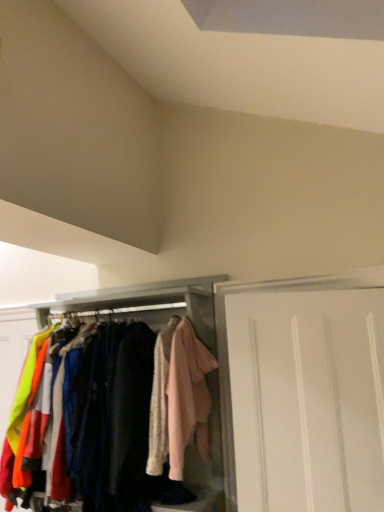
You are a GUI agent. You are given a task and a screenshot of the screen. Output one action in this format:
    pyautogui.click(x=<x>, y=<y>)
    Task: Click on the light pink fabric at center
    
    Given the screenshot: What is the action you would take?
    pyautogui.click(x=178, y=398)

Measure the distance between light pink fabric at center and camera.

light pink fabric at center and camera are 6.21 feet apart.

Find the location of a particular element. The width and height of the screenshot is (384, 512). white matte cabinet at center is located at coordinates (105, 316).

From a real-world perspective, is light pink fabric at center on top of white matte cabinet at center?

Yes, from a real-world perspective, light pink fabric at center is over white matte cabinet at center

Is light pink fabric at center at the right side of white matte cabinet at center?

Yes, light pink fabric at center is to the right of white matte cabinet at center.

Is light pink fabric at center looking in the opposite direction of white matte cabinet at center?

Absolutely, light pink fabric at center is directed away from white matte cabinet at center.

In terms of size, does white matte door at right appear bigger or smaller than white matte cabinet at center?

Clearly, white matte door at right is smaller in size than white matte cabinet at center.

Does point (224, 314) come farther from viewer compared to point (110, 291)?

No, it is in front of (110, 291).

Is white matte door at right not inside white matte cabinet at center?

That's correct, white matte door at right is outside of white matte cabinet at center.

Is white matte cabinet at center spatially inside light pink fabric at center, or outside of it?

white matte cabinet at center is located beyond the bounds of light pink fabric at center.

Identify the location of cabinetry on the left of light pink fabric at center. This screenshot has width=384, height=512. (105, 316).

Can you tell me how much white matte cabinet at center and light pink fabric at center differ in facing direction?

They differ by 4.7 degrees in their facing directions.

Considering the sizes of objects white matte cabinet at center and light pink fabric at center in the image provided, who is taller, white matte cabinet at center or light pink fabric at center?

Standing taller between the two is white matte cabinet at center.

Could you tell me if light pink fabric at center is turned towards white matte door at right?

No.

Which of these two, light pink fabric at center or white matte door at right, is bigger?

With larger size is white matte door at right.

From a real-world perspective, is light pink fabric at center beneath white matte door at right?

No.

Would you say white matte door at right is part of light pink fabric at center's contents?

No, light pink fabric at center does not contain white matte door at right.

The width and height of the screenshot is (384, 512). I want to click on door above the white matte cabinet at center (from the image's perspective), so click(x=303, y=392).

Considering the sizes of objects white matte cabinet at center and white matte door at right in the image provided, who is wider, white matte cabinet at center or white matte door at right?

Wider between the two is white matte cabinet at center.

Could you tell me if white matte cabinet at center is facing white matte door at right?

Answer: No, white matte cabinet at center does not turn towards white matte door at right.

From the image's perspective, is white matte door at right above light pink fabric at center?

No.

From a real-world perspective, who is located higher, white matte door at right or light pink fabric at center?

light pink fabric at center is physically above.

Who is shorter, white matte door at right or light pink fabric at center?

light pink fabric at center.

Does white matte door at right contain light pink fabric at center?

No, light pink fabric at center is not a part of white matte door at right.

The width and height of the screenshot is (384, 512). I want to click on cabinetry behind the light pink fabric at center, so click(105, 316).

At what (x,y) coordinates should I click in order to perform the action: click on door that is on the right side of white matte cabinet at center. Please return your answer as a coordinate pair (x, y). This screenshot has height=512, width=384. Looking at the image, I should click on (303, 392).

When comparing their distances from light pink fabric at center, does white matte door at right or white matte cabinet at center seem further?

white matte door at right is positioned further to the anchor light pink fabric at center.

Considering their positions, is white matte door at right positioned further to white matte cabinet at center than light pink fabric at center?

The object further to white matte cabinet at center is white matte door at right.

Considering their positions, is white matte cabinet at center positioned further to white matte door at right than light pink fabric at center?

The object further to white matte door at right is white matte cabinet at center.

In the scene shown: From the image, which object appears to be farther from white matte door at right, light pink fabric at center or white matte cabinet at center?

The object further to white matte door at right is white matte cabinet at center.

When comparing their distances from light pink fabric at center, does white matte cabinet at center or white matte door at right seem further?

Based on the image, white matte door at right appears to be further to light pink fabric at center.

Based on their spatial positions, is light pink fabric at center or white matte door at right further from white matte cabinet at center?

The object further to white matte cabinet at center is white matte door at right.

I want to click on clothing located between white matte cabinet at center and white matte door at right in the left-right direction, so click(178, 398).